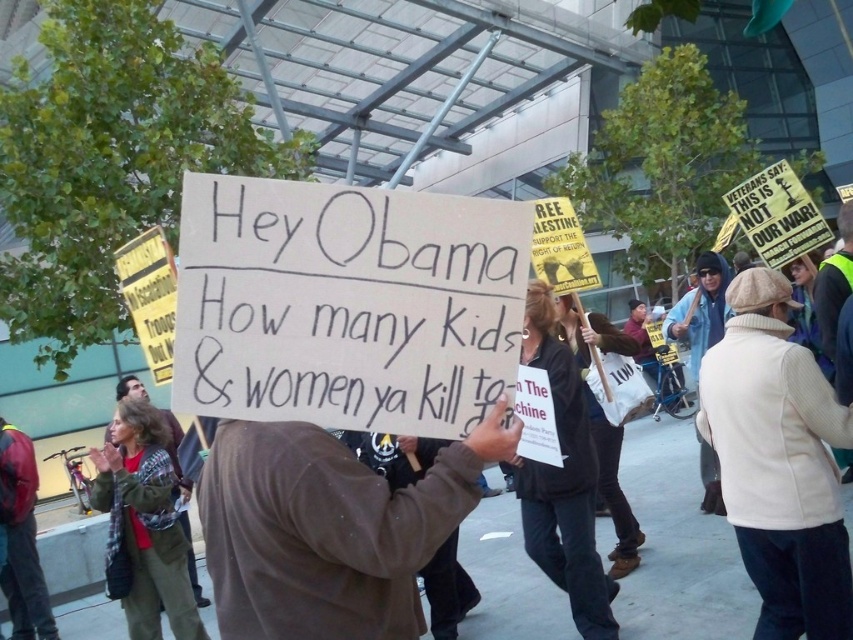
Is dark brown leather jacket at lower left shorter than green plaid shirt at center?

Indeed, dark brown leather jacket at lower left has a lesser height compared to green plaid shirt at center.

Is point (33, 548) farther from camera compared to point (187, 563)?

Yes, it is behind point (187, 563).

The height and width of the screenshot is (640, 853). Find the location of `dark brown leather jacket at lower left`. dark brown leather jacket at lower left is located at coordinates (24, 545).